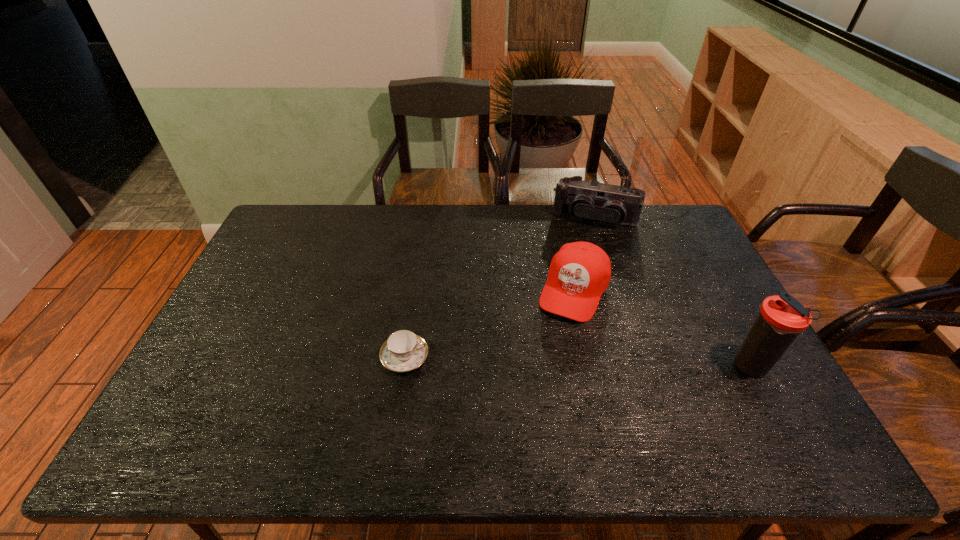
The width and height of the screenshot is (960, 540). In order to click on the leftmost object in this screenshot , I will do coord(404,351).

The image size is (960, 540). I want to click on teacup, so click(404, 351).

Where is `the tallest object`? the tallest object is located at coordinates (782, 318).

The width and height of the screenshot is (960, 540). I want to click on the rightmost object, so click(782, 318).

Identify the location of the third nearest object. (579, 273).

Where is `camcorder`? The image size is (960, 540). camcorder is located at coordinates (585, 200).

Find the location of a particular element. Image resolution: width=960 pixels, height=540 pixels. free region located on the side with the handle of the shortest object is located at coordinates (463, 357).

Find the location of `blank space located 0.080m on the front of the thermos bottle`. blank space located 0.080m on the front of the thermos bottle is located at coordinates (776, 413).

You are a GUI agent. You are given a task and a screenshot of the screen. Output one action in this format:
    pyautogui.click(x=<x>, y=<y>)
    Task: Click on the free spot located on the front panel of the second farthest object
    The height and width of the screenshot is (540, 960).
    Given the screenshot: What is the action you would take?
    pyautogui.click(x=541, y=368)

Where is `vacant space situated 0.110m on the front panel of the second farthest object`? vacant space situated 0.110m on the front panel of the second farthest object is located at coordinates (550, 348).